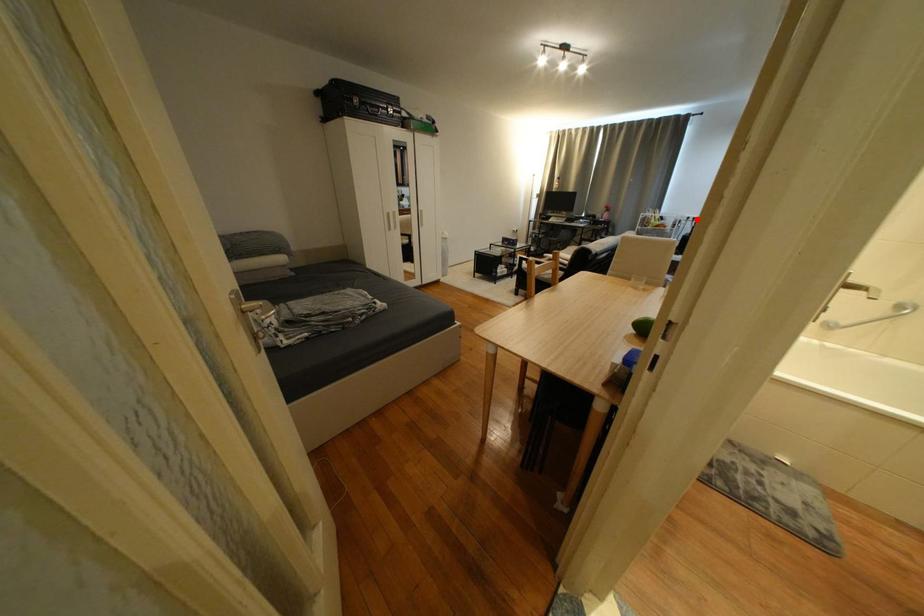
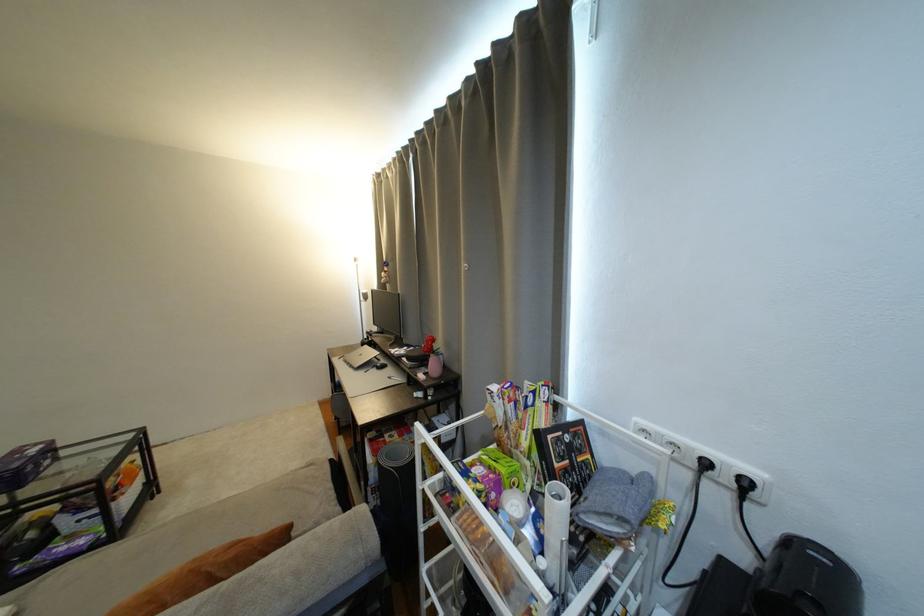
In the second image, find the point that corresponds to the highlighted location in the first image.

(714, 466)